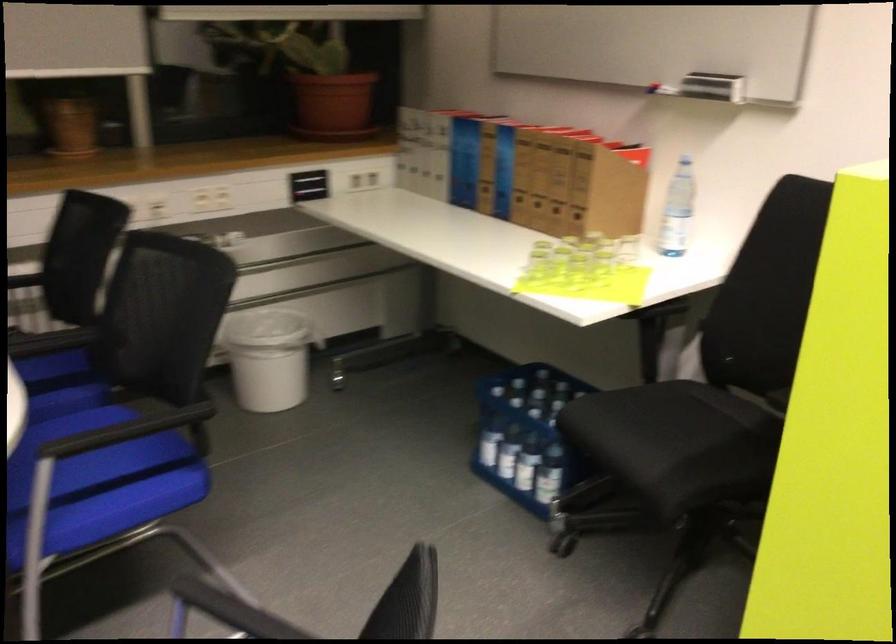
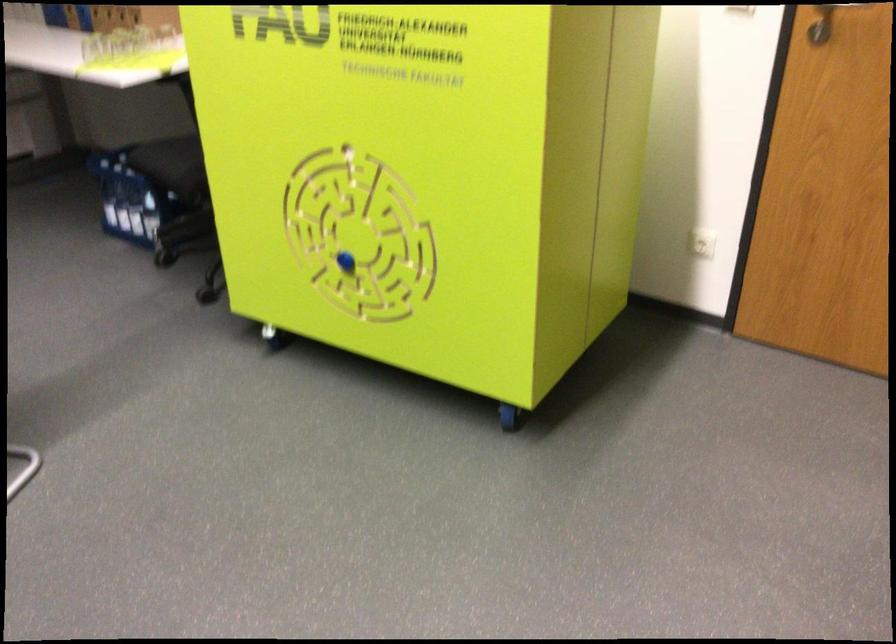
The point at (547, 433) is marked in the first image. Where is the corresponding point in the second image?

(149, 185)